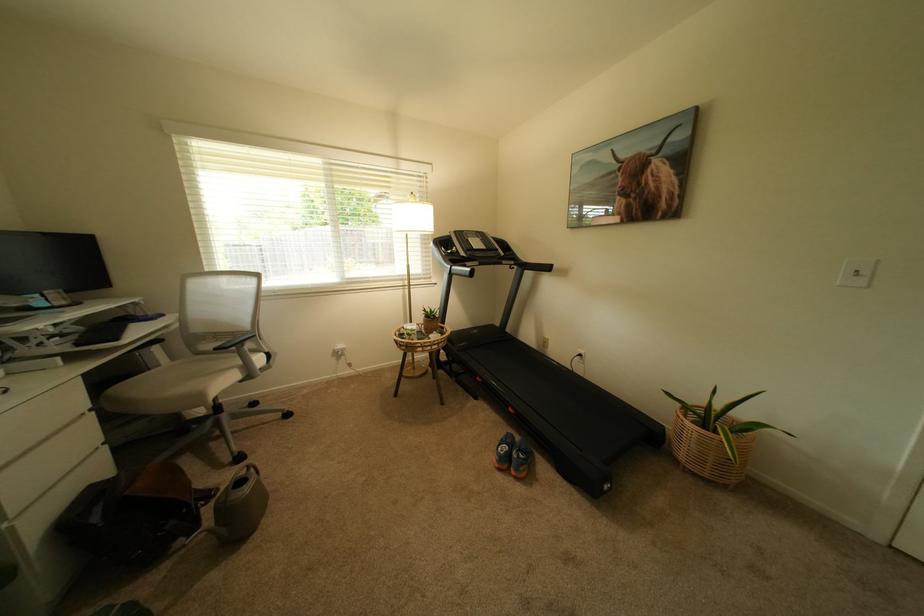
This screenshot has width=924, height=616. Describe the element at coordinates (479, 243) in the screenshot. I see `a treadmill button` at that location.